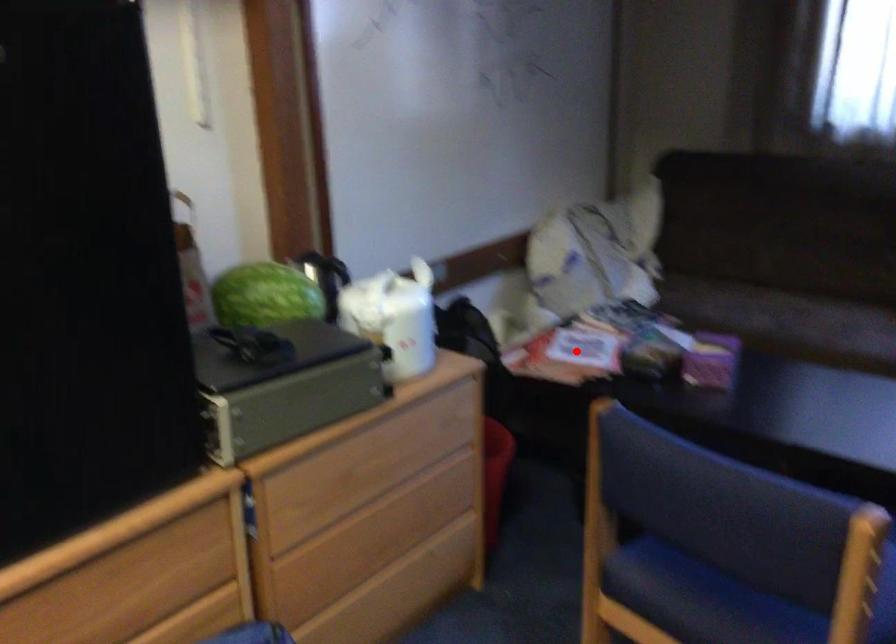
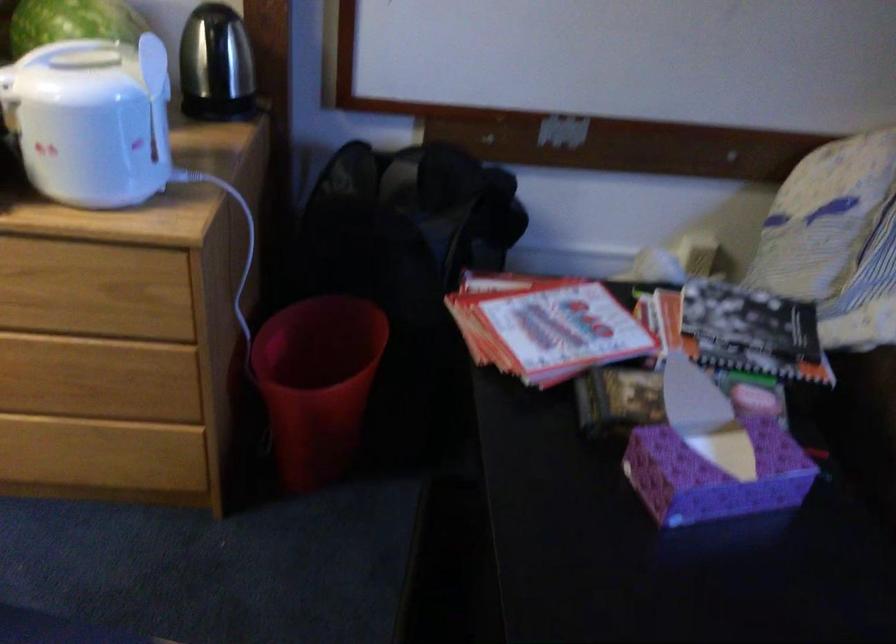
Question: I am providing you with two images of the same scene from different viewpoints. In image1, a red point is highlighted. Considering the same 3D point in image2, which of the following is correct?

Choices:
 (A) It is closer
 (B) It is farther

Answer: (A)